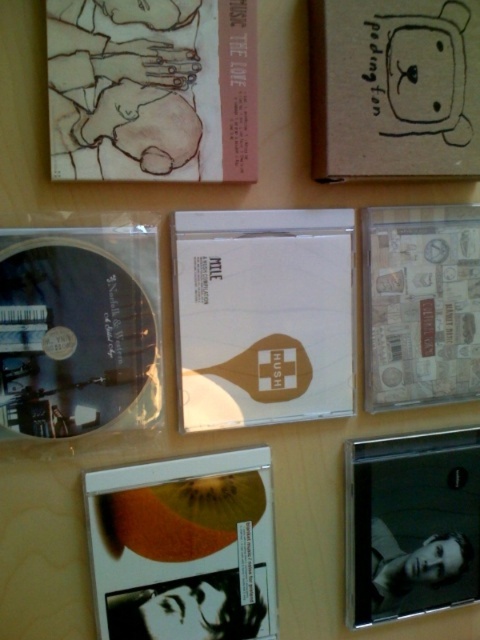
Question: Which point is farther from the camera taking this photo?

Choices:
 (A) (123, 364)
 (B) (444, 106)

Answer: (B)

Question: Which object is positioned farthest from the wooden cd case at right?

Choices:
 (A) white matte cd at center
 (B) matte black album at upper left

Answer: (B)

Question: Which is nearer to the matte black album at upper left?

Choices:
 (A) transparent plastic cd at upper left
 (B) black glossy cd case at bottom right

Answer: (A)

Question: Is matte black album at upper left further to camera compared to transparent plastic cd at upper left?

Choices:
 (A) yes
 (B) no

Answer: (B)

Question: Can you confirm if transparent plastic cd at upper left is positioned to the left of brown cardboard book at upper right?

Choices:
 (A) yes
 (B) no

Answer: (A)

Question: Observing the image, what is the correct spatial positioning of white matte cd at center in reference to matte black album at upper left?

Choices:
 (A) below
 (B) above

Answer: (A)